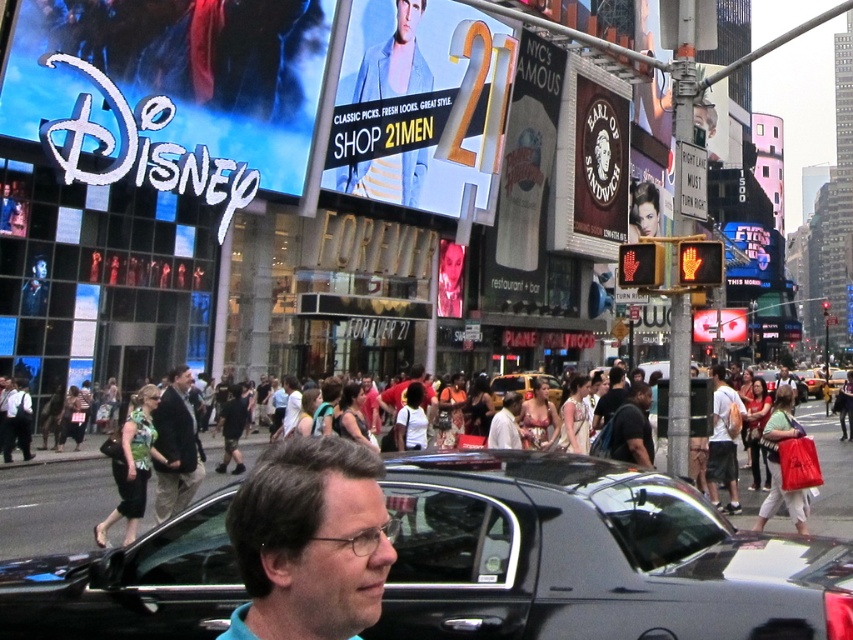
Question: Which point is closer to the camera taking this photo?

Choices:
 (A) (x=772, y=509)
 (B) (x=344, y=83)
 (C) (x=537, y=376)

Answer: (A)

Question: Which point is farther to the camera?

Choices:
 (A) metallic silver sign at center
 (B) matte red bag at lower right
 (C) matte black backpack at center

Answer: (A)

Question: Can you confirm if blue shirt at center is smaller than matte red bag at lower right?

Choices:
 (A) no
 (B) yes

Answer: (B)

Question: Is matte yellow sign at center bigger than white cotton backpack at center-right?

Choices:
 (A) no
 (B) yes

Answer: (B)

Question: Is yellow matte taxi cab at center above matte black backpack at center?

Choices:
 (A) yes
 (B) no

Answer: (A)

Question: Which point appears farthest from the camera in this image?

Choices:
 (A) (407, 157)
 (B) (792, 396)
 (C) (169, 513)

Answer: (A)